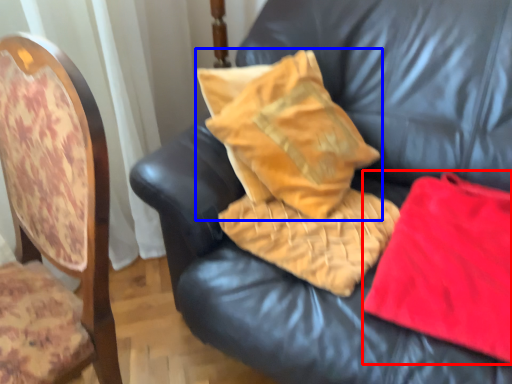
Question: Which object appears closest to the camera in this image, material (highlighted by a red box) or pillow (highlighted by a blue box)?

Choices:
 (A) material
 (B) pillow

Answer: (A)